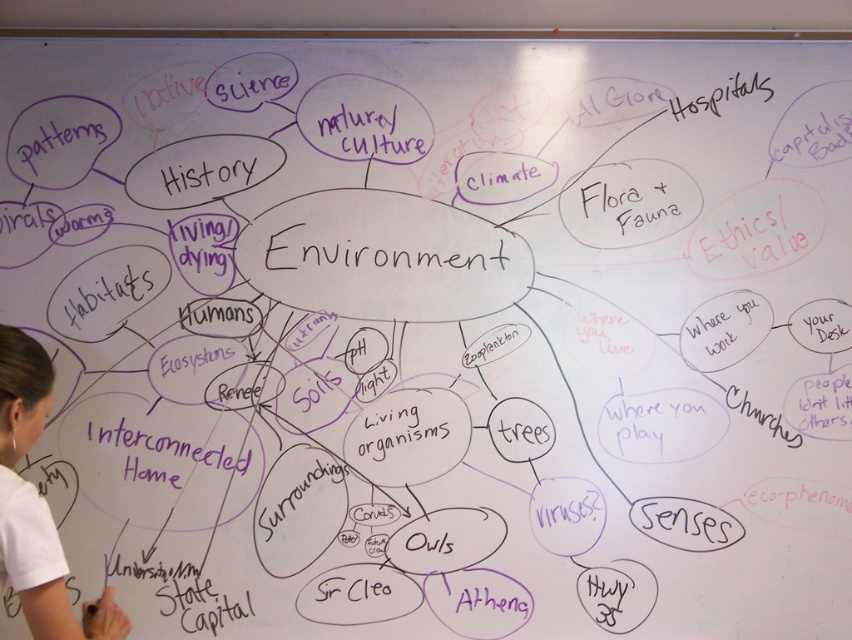
You are standing in front of the whiteboard and want to point to both the point at location (44, 532) and the point at (190, 592). Which point do you need to reach further to touch?

The point at (190, 592) requires reaching further because it is farther from the camera compared to the point at (44, 532).